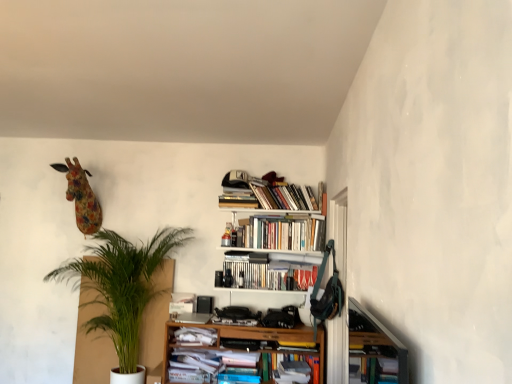
Question: Is white paper at lower center, the fourth book when ordered from top to bottom, bigger than floral fabric giraffe at upper left?

Choices:
 (A) no
 (B) yes

Answer: (A)

Question: Considering the relative sizes of white paper at lower center, marked as the 2th book in a bottom-to-top arrangement, and floral fabric giraffe at upper left in the image provided, is white paper at lower center, marked as the 2th book in a bottom-to-top arrangement, thinner than floral fabric giraffe at upper left?

Choices:
 (A) yes
 (B) no

Answer: (A)

Question: Is white paper at lower center, the fourth book when ordered from top to bottom, completely or partially outside of floral fabric giraffe at upper left?

Choices:
 (A) yes
 (B) no

Answer: (A)

Question: From the image's perspective, is white paper at lower center, marked as the 2th book in a bottom-to-top arrangement, above floral fabric giraffe at upper left?

Choices:
 (A) yes
 (B) no

Answer: (B)

Question: Does white paper at lower center, the fourth book when ordered from top to bottom, have a greater height compared to floral fabric giraffe at upper left?

Choices:
 (A) yes
 (B) no

Answer: (B)

Question: Is white wooden bookshelf at upper center to the left or to the right of wooden bookshelf at lower right in the image?

Choices:
 (A) right
 (B) left

Answer: (B)

Question: In terms of height, does white wooden bookshelf at upper center look taller or shorter compared to wooden bookshelf at lower right?

Choices:
 (A) tall
 (B) short

Answer: (A)

Question: Which is correct: white wooden bookshelf at upper center is inside wooden bookshelf at lower right, or outside of it?

Choices:
 (A) inside
 (B) outside

Answer: (B)

Question: Considering the positions of white wooden bookshelf at upper center and wooden bookshelf at lower right in the image, is white wooden bookshelf at upper center wider or thinner than wooden bookshelf at lower right?

Choices:
 (A) wide
 (B) thin

Answer: (A)

Question: Is point (320, 183) positioned closer to the camera than point (78, 205)?

Choices:
 (A) closer
 (B) farther

Answer: (B)

Question: From the image's perspective, is hardcover books at upper center, the 1th book viewed from the top, above or below floral fabric giraffe at upper left?

Choices:
 (A) above
 (B) below

Answer: (A)

Question: Is hardcover books at upper center, the 1th book viewed from the top, in front of or behind floral fabric giraffe at upper left in the image?

Choices:
 (A) behind
 (B) front

Answer: (A)

Question: Considering the positions of hardcover books at upper center, the 1th book viewed from the top, and floral fabric giraffe at upper left in the image, is hardcover books at upper center, the 1th book viewed from the top, wider or thinner than floral fabric giraffe at upper left?

Choices:
 (A) wide
 (B) thin

Answer: (B)

Question: Is floral fabric giraffe at upper left inside the boundaries of hardcover books at upper center, which is the fifth book in bottom-to-top order, or outside?

Choices:
 (A) outside
 (B) inside

Answer: (A)

Question: From the image's perspective, relative to hardcover books at upper center, the 1th book viewed from the top, is floral fabric giraffe at upper left above or below?

Choices:
 (A) above
 (B) below

Answer: (B)